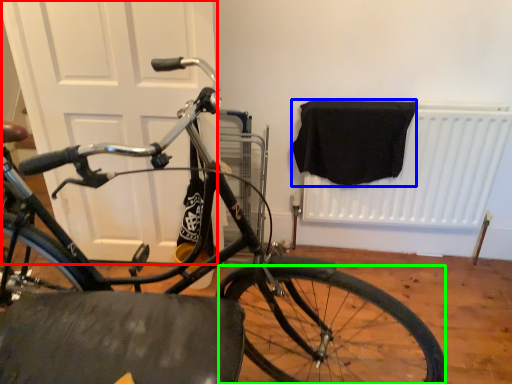
Question: Which object is the closest to the door (highlighted by a red box)? Choose among these: blanket (highlighted by a blue box) or bicycle wheel (highlighted by a green box).

Choices:
 (A) blanket
 (B) bicycle wheel

Answer: (A)